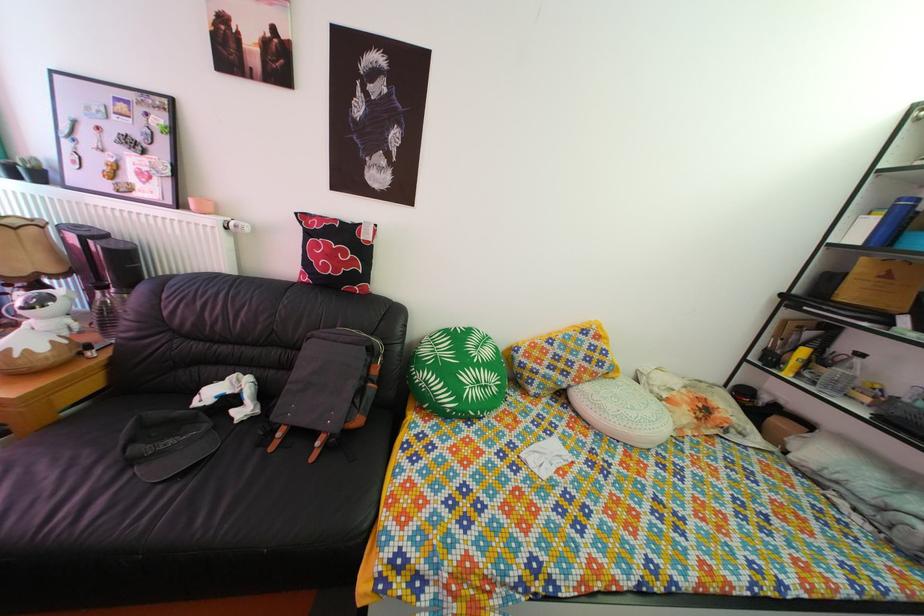
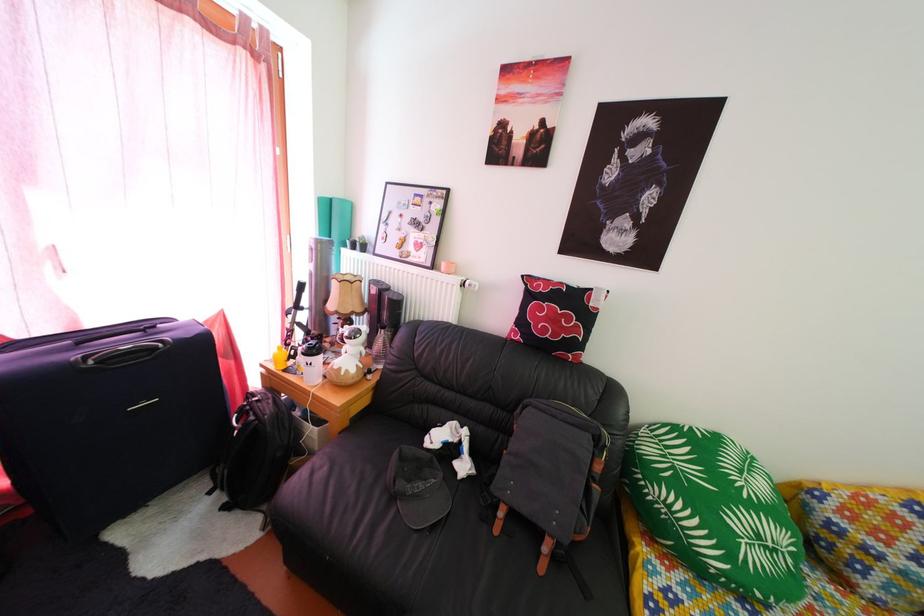
Find the pixel in the second image that matches the point at 166,422 in the first image.

(419, 458)